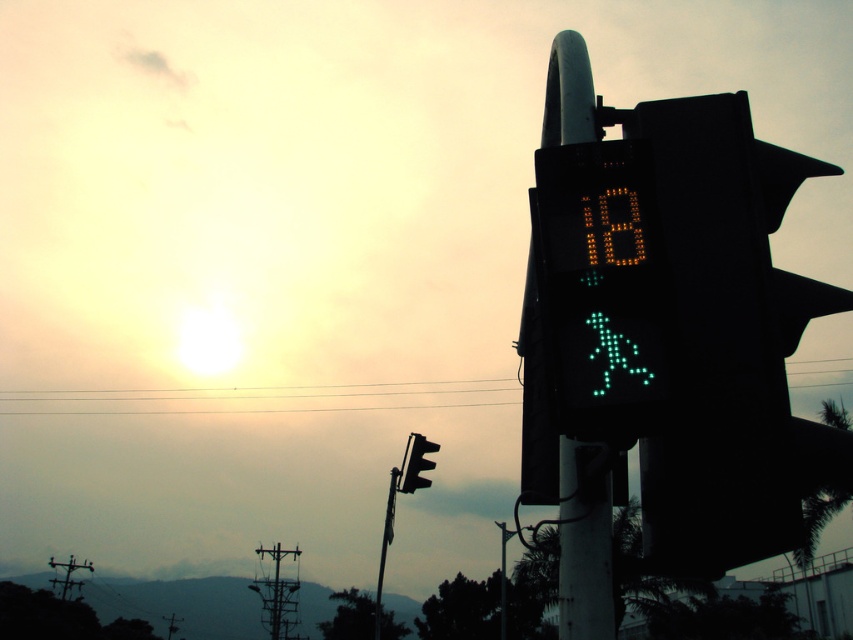
You are standing at the crosswalk and see the point marked at coordinates (730, 346). Which object is this point located on?

The point marked at coordinates (730, 346) is located on the black plastic pedestrian signal at right.

You are a delivery person holding a large box that is 2 meters wide. You need to walk past the black plastic pedestrian signal at right without hitting it. Is there enough space to pass safely?

The black plastic pedestrian signal at right is 1.96 meters away from the camera, so the delivery person cannot safely pass with a box that is 2 meters wide as the box would extend beyond the available space.